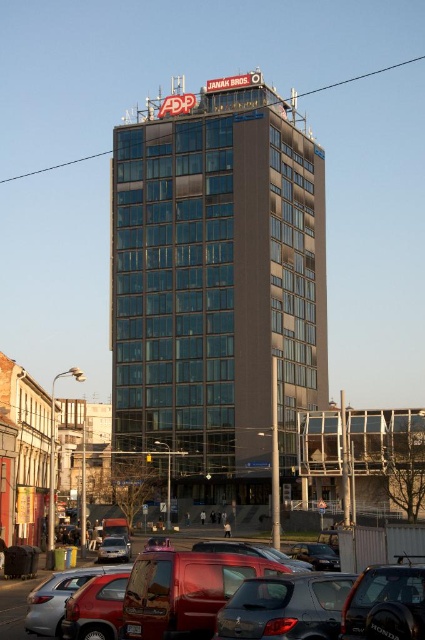
You are a city planner assessing the urban layout. You notice the matte gray building at lower left and the silver metallic suv at lower left. Which object occupies more space in the scene?

The matte gray building at lower left has a larger size compared to the silver metallic suv at lower left, so it occupies more space in the scene.

You are a city planner evaluating the urban space in the image. You need to determine if the transparent glass building at center can be seen from the silver metallic suv at lower left. Based on their sizes and positions, what is your assessment?

The transparent glass building at center is bigger than the silver metallic suv at lower left. Since the building is larger and centrally located, it is likely visible from the suv.